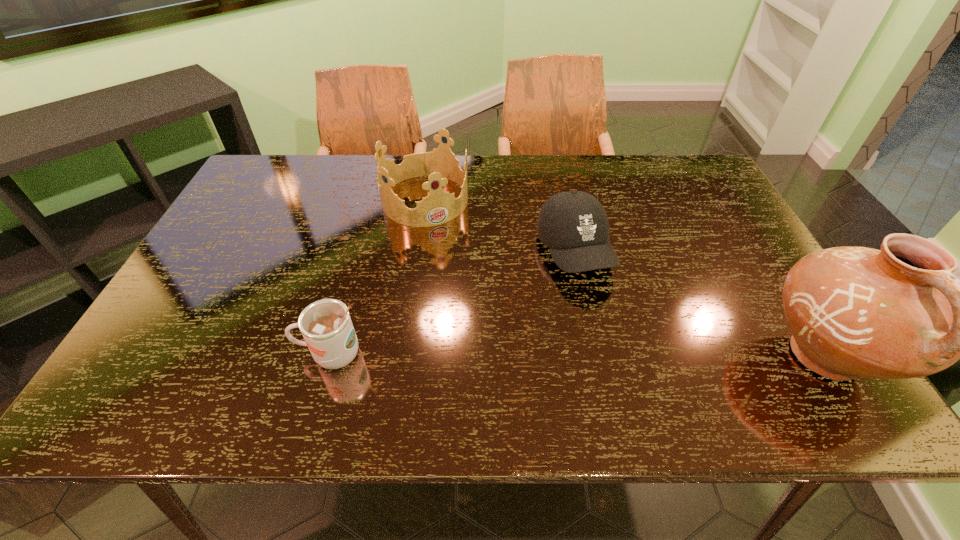
The image size is (960, 540). Find the location of `cup`. cup is located at coordinates (326, 326).

The width and height of the screenshot is (960, 540). I want to click on pottery, so tap(896, 313).

You are a GUI agent. You are given a task and a screenshot of the screen. Output one action in this format:
    pyautogui.click(x=<x>, y=<y>)
    Task: Click on the tallest object
    This screenshot has height=540, width=960.
    Given the screenshot: What is the action you would take?
    pyautogui.click(x=896, y=313)

The height and width of the screenshot is (540, 960). I want to click on tiara, so click(x=440, y=165).

What are the coordinates of `baseball cap` in the screenshot? It's located at (574, 225).

What are the coordinates of `free space located on the side with the handle of the cup` in the screenshot? It's located at (211, 354).

Find the location of a particular element. The width and height of the screenshot is (960, 540). vacant area located on the side with the handle of the cup is located at coordinates (146, 354).

Identify the location of vacant area located 0.190m on the side with the handle of the cup. The image size is (960, 540). (206, 354).

Where is `vacant space situated 0.200m on the front-facing side of the tiara`? vacant space situated 0.200m on the front-facing side of the tiara is located at coordinates (466, 271).

Find the location of `vacant point located 0.390m on the front-facing side of the tiara`. vacant point located 0.390m on the front-facing side of the tiara is located at coordinates (497, 326).